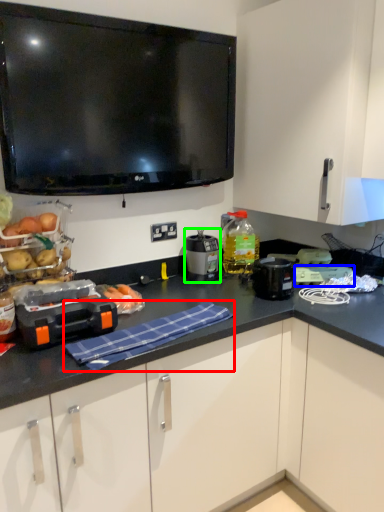
Question: Which object is positioned closest to cloth (highlighted by a red box)? Select from appliance (highlighted by a blue box) and kitchen appliance (highlighted by a green box).

Choices:
 (A) appliance
 (B) kitchen appliance

Answer: (B)